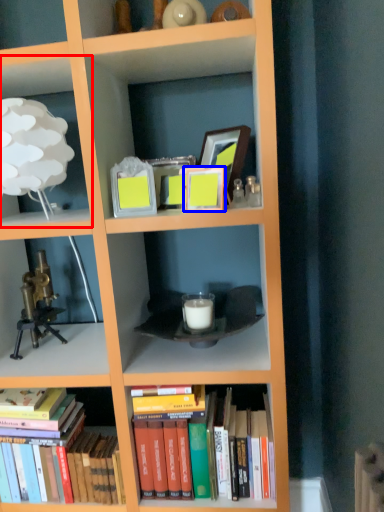
Question: Which object appears closest to the camera in this image, shelf (highlighted by a red box) or picture frame (highlighted by a blue box)?

Choices:
 (A) shelf
 (B) picture frame

Answer: (A)